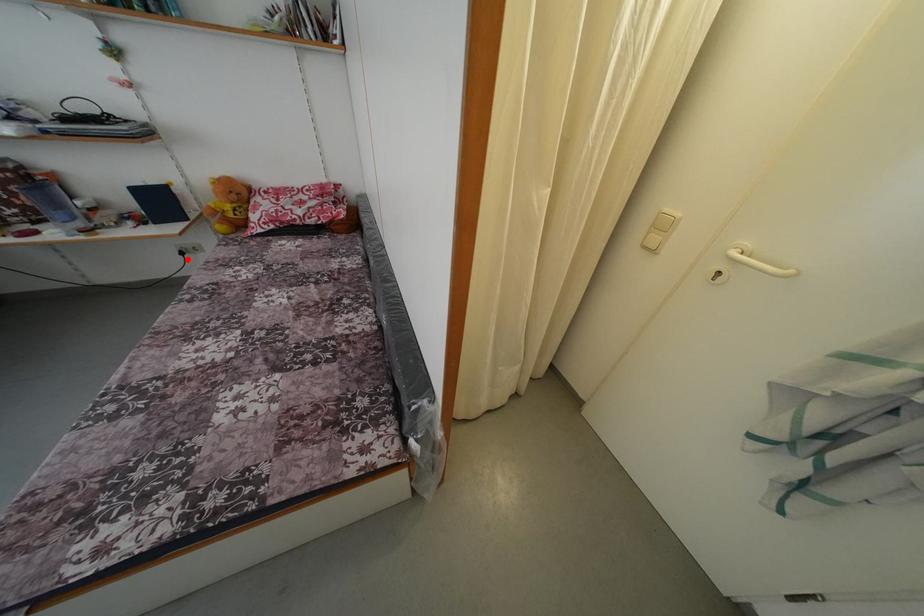
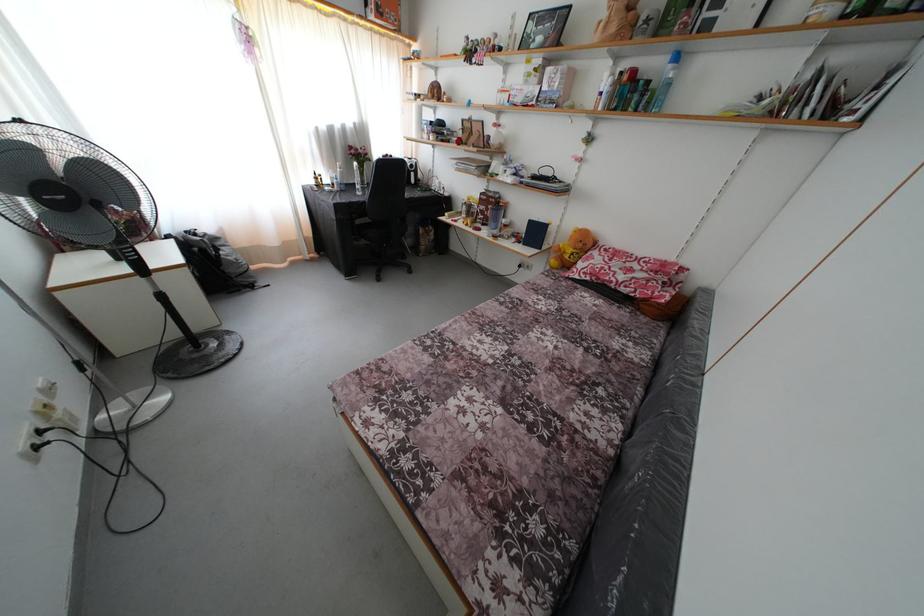
Question: I am providing you with two images of the same scene from different viewpoints. A red point is shown in image1. For the corresponding object point in image2, is it positioned nearer or farther from the camera?

Choices:
 (A) Nearer
 (B) Farther

Answer: (A)